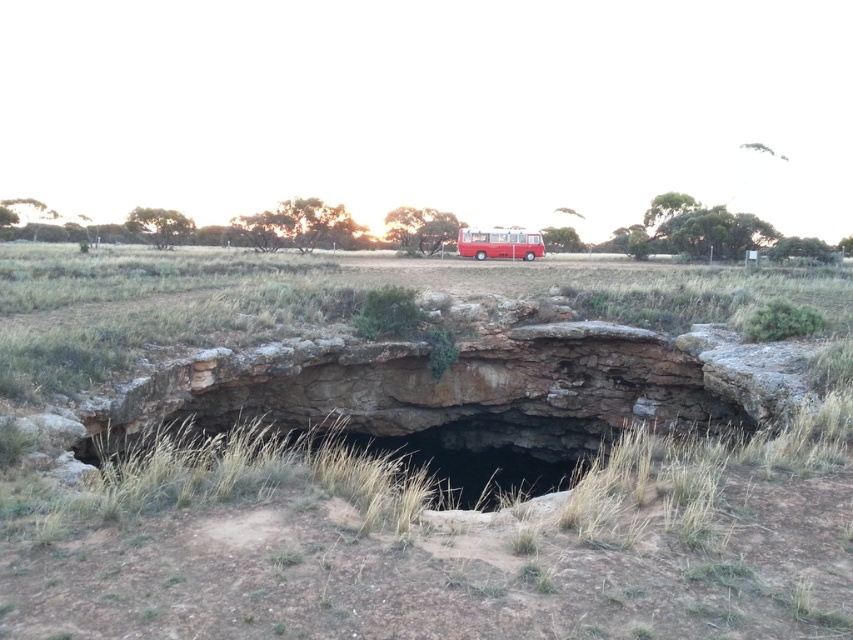
Question: Which object appears closest to the camera in this image?

Choices:
 (A) dry grass at center
 (B) matte red bus at center

Answer: (A)

Question: Which of the following is the farthest from the observer?

Choices:
 (A) matte red bus at center
 (B) dry grass at center

Answer: (A)

Question: Can you confirm if dry grass at center is positioned to the right of matte red bus at center?

Choices:
 (A) no
 (B) yes

Answer: (A)

Question: Does dry grass at center have a larger size compared to matte red bus at center?

Choices:
 (A) no
 (B) yes

Answer: (B)

Question: Is dry grass at center smaller than matte red bus at center?

Choices:
 (A) yes
 (B) no

Answer: (B)